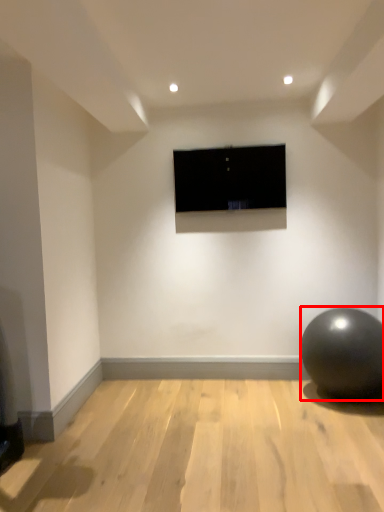
Question: In this image, where is ball (annotated by the red box) located relative to television?

Choices:
 (A) right
 (B) left

Answer: (A)